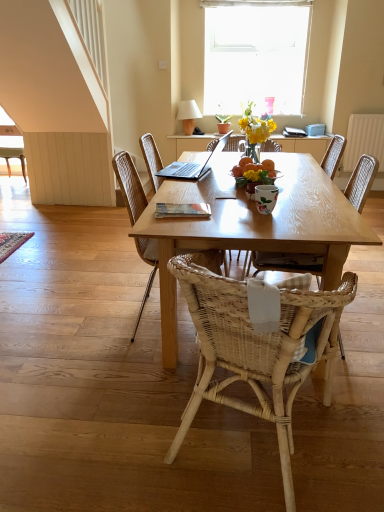
Where is `free space to the left of wooden table at center`? This screenshot has height=512, width=384. free space to the left of wooden table at center is located at coordinates (80, 315).